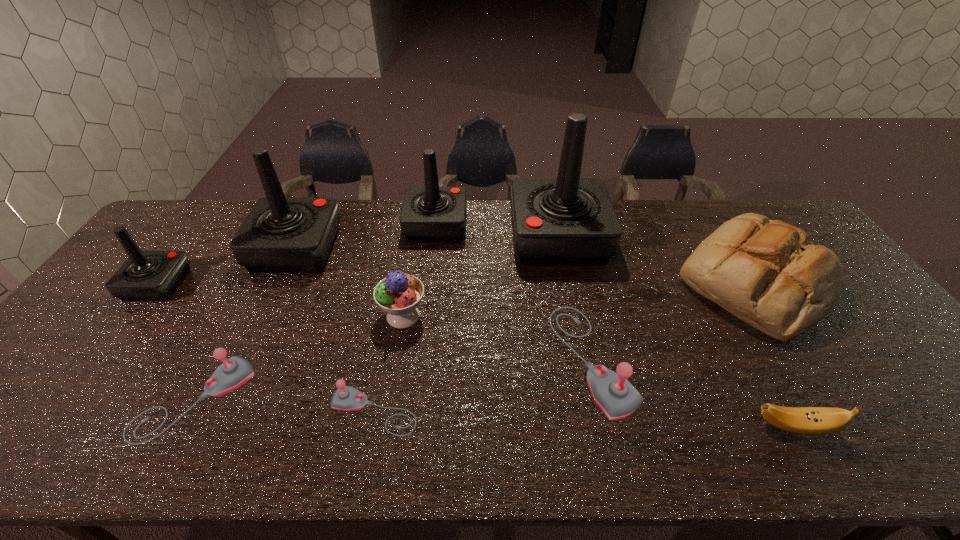
At what (x,y) coordinates should I click in order to perform the action: click on banana that is at the near edge. Please return your answer as a coordinate pair (x, y). Image resolution: width=960 pixels, height=540 pixels. Looking at the image, I should click on (804, 420).

The width and height of the screenshot is (960, 540). Find the location of `object that is at the left edge`. object that is at the left edge is located at coordinates (146, 275).

The image size is (960, 540). Identify the location of object that is positioned at the right edge. (767, 273).

What are the coordinates of `object that is at the far right corner` in the screenshot? It's located at (767, 273).

Locate an element on the screen. The image size is (960, 540). vacant area at the far edge of the desktop is located at coordinates (723, 203).

This screenshot has width=960, height=540. In the image, there is a desktop. In order to click on vacant area at the near edge in this screenshot , I will do `click(131, 426)`.

The height and width of the screenshot is (540, 960). Identify the location of vacant space at the left edge of the desktop. (12, 409).

Image resolution: width=960 pixels, height=540 pixels. I want to click on vacant space at the right edge of the desktop, so click(867, 350).

Where is `empty location between the banana and the third tallest object`? empty location between the banana and the third tallest object is located at coordinates (615, 326).

Find the location of a particular element. vacant area that lies between the icecream and the second shortest joystick is located at coordinates (300, 357).